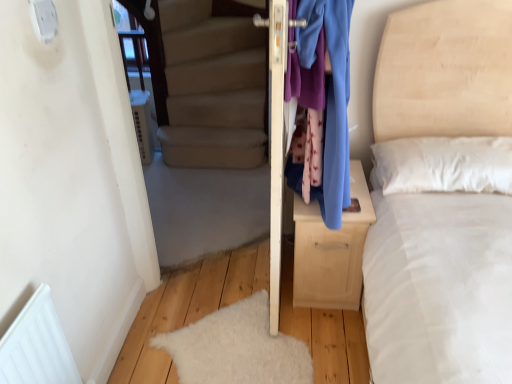
The height and width of the screenshot is (384, 512). I want to click on vacant area on top of white fluffy mat at lower left (from a real-world perspective), so click(234, 326).